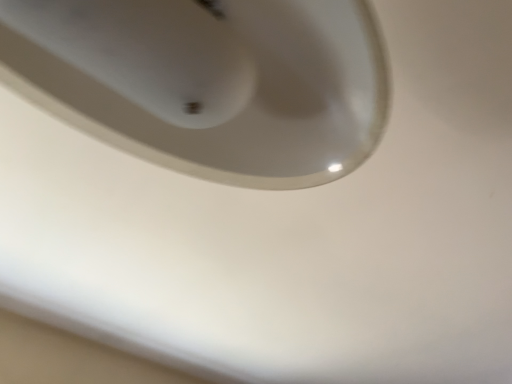
Measure the distance between white glossy mouse at upper center and camera.

white glossy mouse at upper center and camera are 11.46 inches apart from each other.

Image resolution: width=512 pixels, height=384 pixels. Describe the element at coordinates (209, 82) in the screenshot. I see `white glossy mouse at upper center` at that location.

Find the location of a particular element. This screenshot has width=512, height=384. white glossy mouse at upper center is located at coordinates (209, 82).

Image resolution: width=512 pixels, height=384 pixels. I want to click on white glossy mouse at upper center, so click(209, 82).